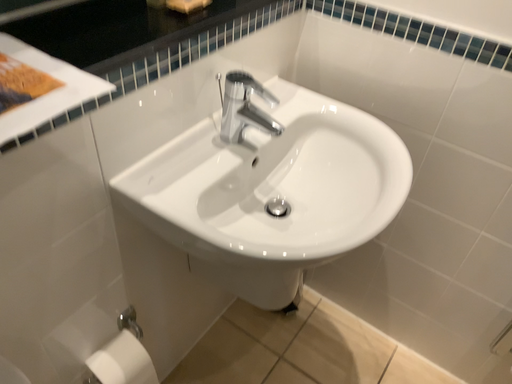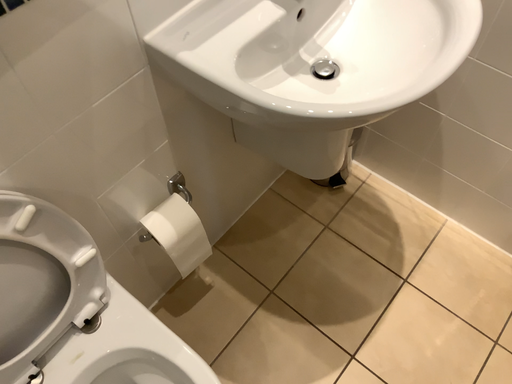
Question: How did the camera likely rotate when shooting the video?

Choices:
 (A) rotated downward
 (B) rotated upward

Answer: (A)